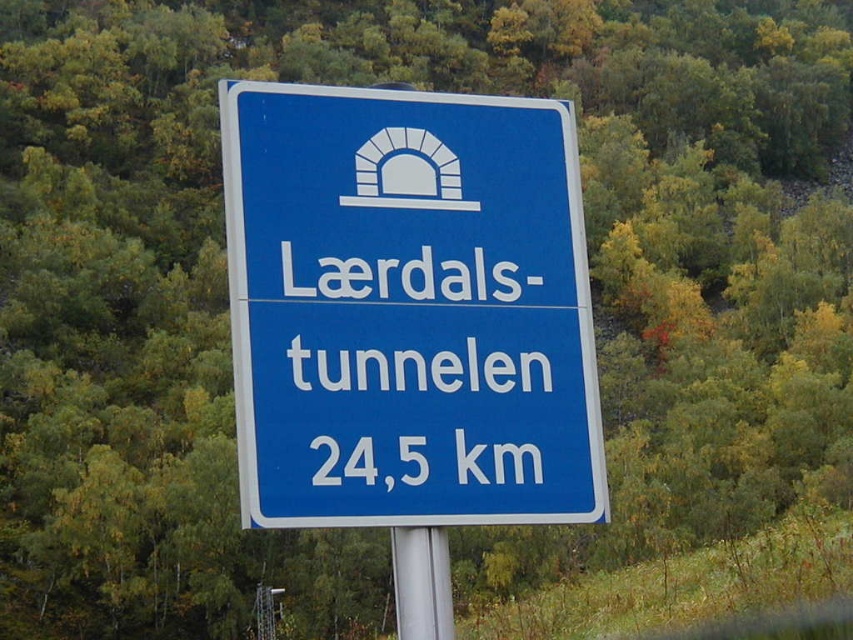
Question: Which point appears closest to the camera in this image?

Choices:
 (A) (309, 211)
 (B) (447, 545)

Answer: (B)

Question: Where is blue plastic sign at center located in relation to silver metallic pole at center in the image?

Choices:
 (A) below
 (B) above

Answer: (B)

Question: Which object appears closest to the camera in this image?

Choices:
 (A) silver metallic pole at center
 (B) blue plastic sign at center

Answer: (B)

Question: Which object appears closest to the camera in this image?

Choices:
 (A) blue plastic sign at center
 (B) silver metallic pole at center

Answer: (A)

Question: Can you confirm if blue plastic sign at center is smaller than silver metallic pole at center?

Choices:
 (A) yes
 (B) no

Answer: (B)

Question: Is blue plastic sign at center behind silver metallic pole at center?

Choices:
 (A) no
 (B) yes

Answer: (A)